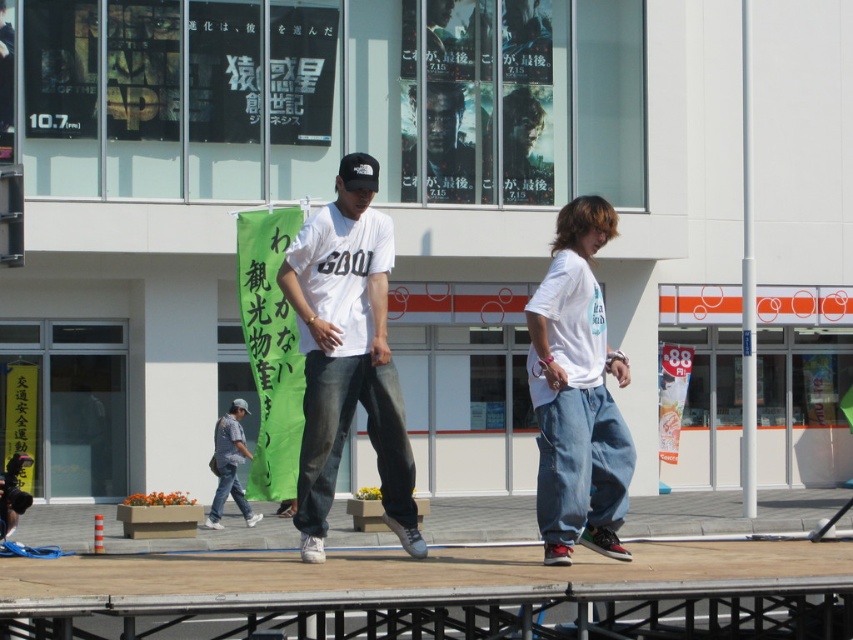
Question: Does white matte t-shirt at center appear on the left side of denim pants at center?

Choices:
 (A) no
 (B) yes

Answer: (B)

Question: Which point is farther from the camera taking this photo?

Choices:
 (A) (335, 401)
 (B) (605, 497)

Answer: (B)

Question: Which object is closer to the camera taking this photo?

Choices:
 (A) denim pants at center
 (B) white matte t-shirt at center

Answer: (A)

Question: Which point is closer to the camera?

Choices:
 (A) white matte t-shirt at center
 (B) denim pants at center

Answer: (B)

Question: In this image, where is white matte t-shirt at center located relative to denim pants at center?

Choices:
 (A) right
 (B) left

Answer: (B)

Question: Observing the image, what is the correct spatial positioning of white matte t-shirt at center in reference to denim pants at center?

Choices:
 (A) above
 (B) below

Answer: (B)